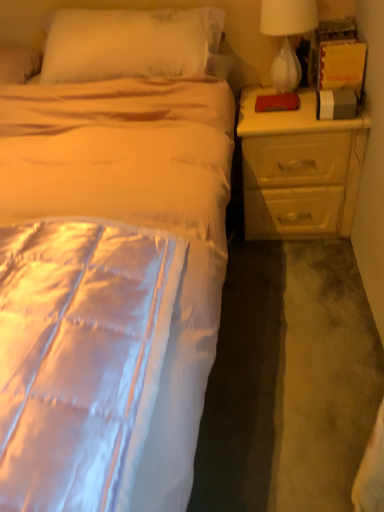
Locate an element on the screen. The image size is (384, 512). vacant space in front of white glass lamp at upper right is located at coordinates (284, 113).